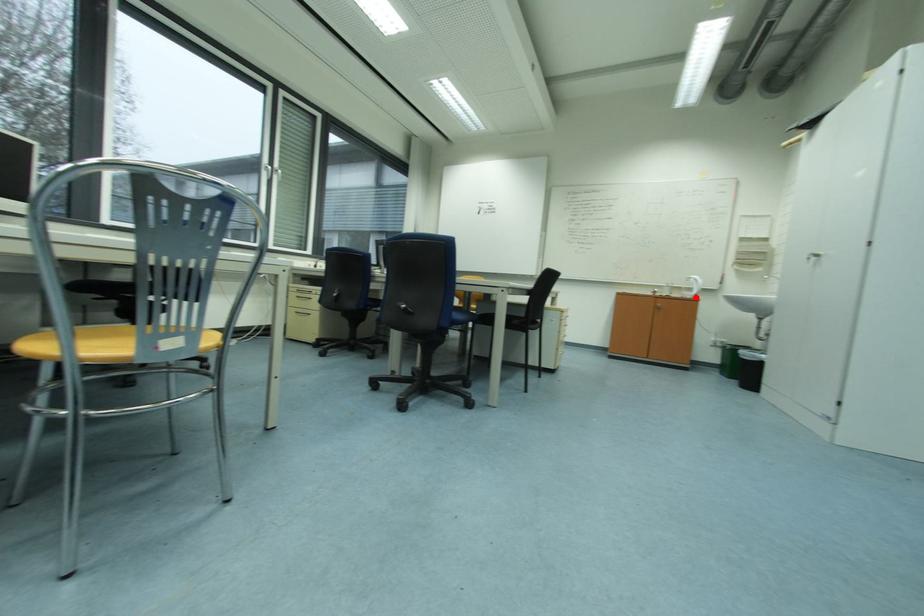
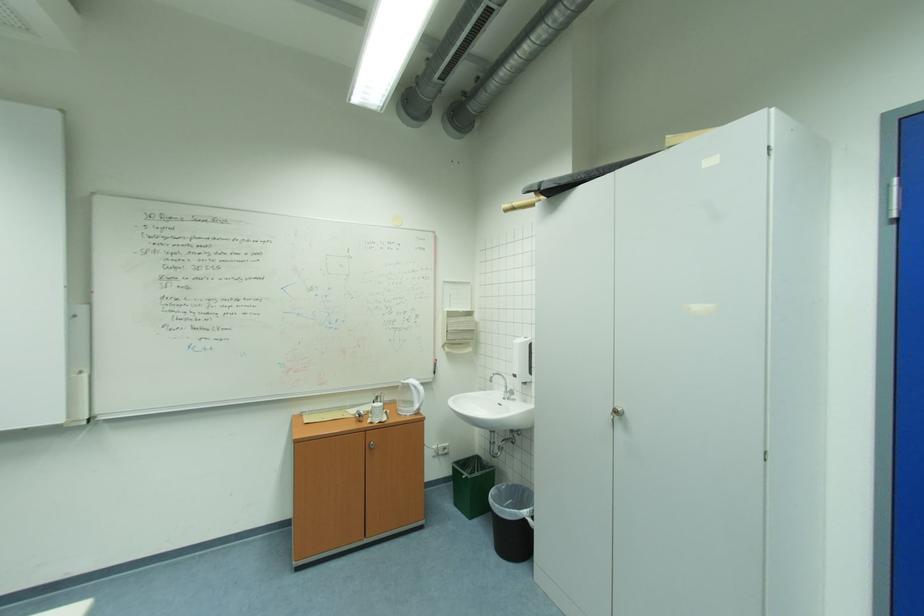
The point at the highlighted location is marked in the first image. Where is the corresponding point in the second image?

(415, 411)